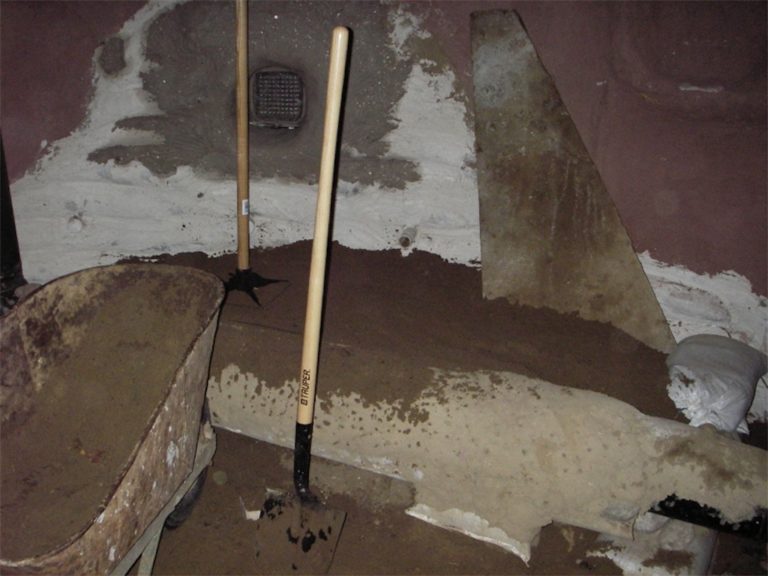
You are a GUI agent. You are given a task and a screenshot of the screen. Output one action in this format:
    pyautogui.click(x=<x>, y=<y>)
    Task: Click on the white wall space
    The height and width of the screenshot is (576, 768).
    Given the screenshot: What is the action you would take?
    pyautogui.click(x=51, y=209), pyautogui.click(x=144, y=206), pyautogui.click(x=121, y=98), pyautogui.click(x=442, y=132), pyautogui.click(x=442, y=204), pyautogui.click(x=376, y=215), pyautogui.click(x=727, y=306)